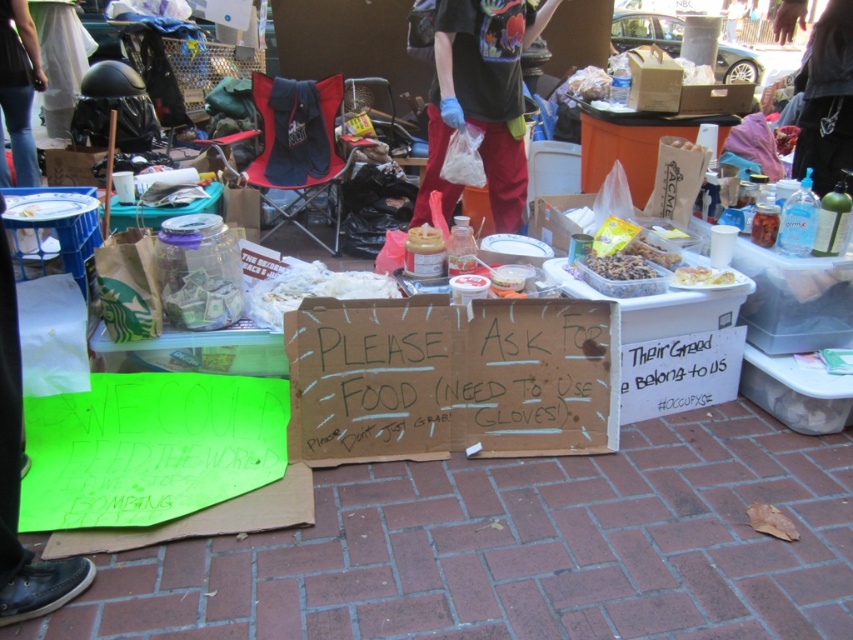
Question: Is black t-shirt at center below dark brown textured nuts at center?

Choices:
 (A) yes
 (B) no

Answer: (B)

Question: Is brick pavement at center below dark brown textured nuts at center?

Choices:
 (A) yes
 (B) no

Answer: (A)

Question: Which point is farther to the camera?

Choices:
 (A) (x=683, y=280)
 (B) (x=445, y=28)
 (C) (x=656, y=250)

Answer: (B)

Question: Can you confirm if brick pavement at center is positioned below crumbly brown granola bar at center?

Choices:
 (A) no
 (B) yes

Answer: (B)

Question: Based on their relative distances, which object is nearer to the crumbly brown granola bar at center?

Choices:
 (A) dark brown textured nuts at center
 (B) white plastic container at center
 (C) black t-shirt at center

Answer: (B)

Question: Which of the following is the farthest from the observer?

Choices:
 (A) dark brown textured nuts at center
 (B) crumbly brown granola bar at center
 (C) black t-shirt at center

Answer: (C)